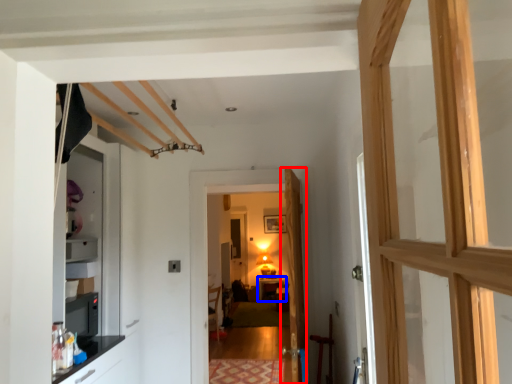
Question: Among these objects, which one is nearest to the camera, door (highlighted by a red box) or table (highlighted by a blue box)?

Choices:
 (A) door
 (B) table

Answer: (A)